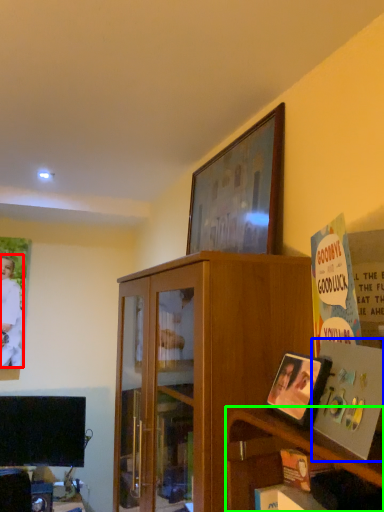
Question: Which object is the closest to the person (highlighted by a red box)? Choose among these: paperback book (highlighted by a blue box) or shelf (highlighted by a green box).

Choices:
 (A) paperback book
 (B) shelf

Answer: (B)